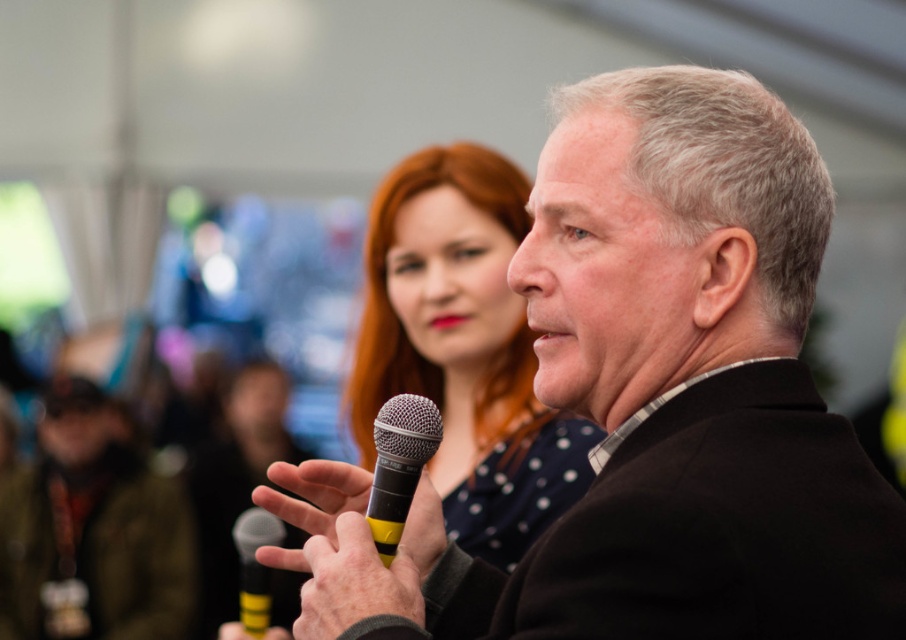
You are an event organizer who needs to place a new speaker stand to the left of the silver metallic microphone at center. Considering the current position of the black matte suit at center, will the stand interfere with it?

The black matte suit at center is positioned on the right side of the silver metallic microphone at center, so placing the speaker stand to the left of the microphone would not interfere with the black matte suit at center.

In the scene shown: You are an event organizer who needs to set up a podium for the next speaker. The podium currently has the silver metallic microphone at center placed on it. Where should you position the black matte suit at center so that it is visible to the audience?

The black matte suit at center should be placed above the silver metallic microphone at center so that it is visible to the audience, as the black matte suit at center is located above the silver metallic microphone at center.

You are attending a public speaking event and want to approach the speaker wearing the black matte suit at center. If you are standing 3 feet away from the speaker, will you be able to shake their hand without moving closer?

The black matte suit at center is 37.06 inches away from the viewer. Since 3 feet equals 36 inches, you are slightly farther away than 3 feet. To shake hands, you need to move about 1.06 inches closer.